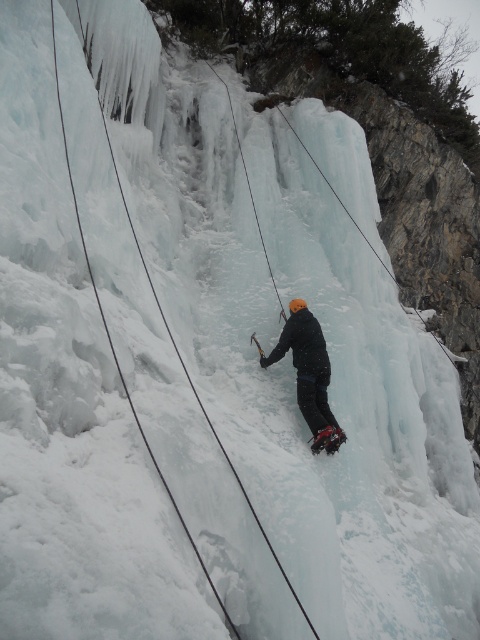
Which is above, matte black jacket at center or black nylon rope at center?

Positioned higher is black nylon rope at center.

Which is more to the left, matte black jacket at center or black nylon rope at center?

From the viewer's perspective, black nylon rope at center appears more on the left side.

Does point (305, 413) lie in front of point (170, 332)?

No, it is not.

Identify the location of matte black jacket at center. [309, 374].